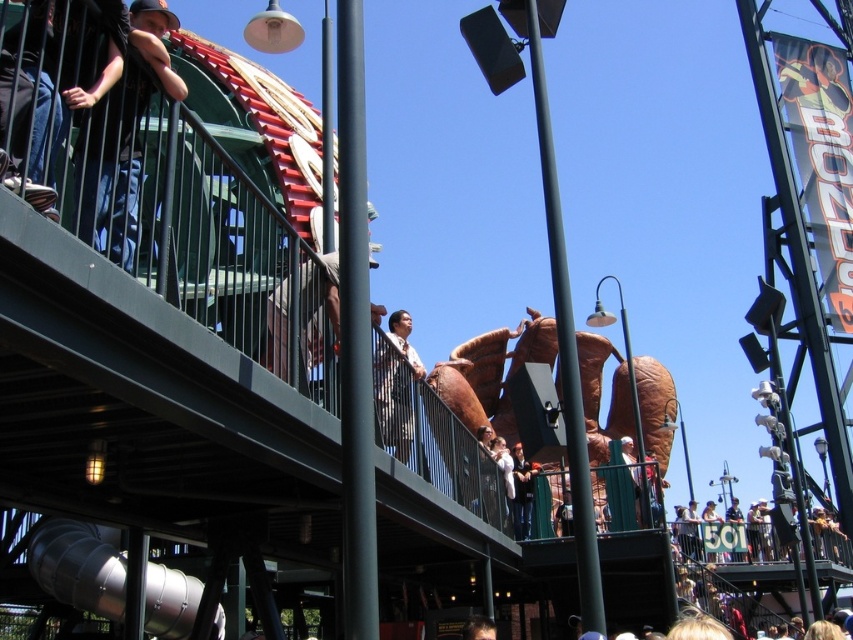
Which of these two, light brown shirt at center or white cotton jacket at center, stands taller?

light brown shirt at center is taller.

Does light brown shirt at center have a greater width compared to white cotton jacket at center?

Yes, light brown shirt at center is wider than white cotton jacket at center.

Is point (381, 426) closer to camera compared to point (514, 497)?

Yes, point (381, 426) is closer to viewer.

Where is `light brown shirt at center`? light brown shirt at center is located at coordinates (396, 385).